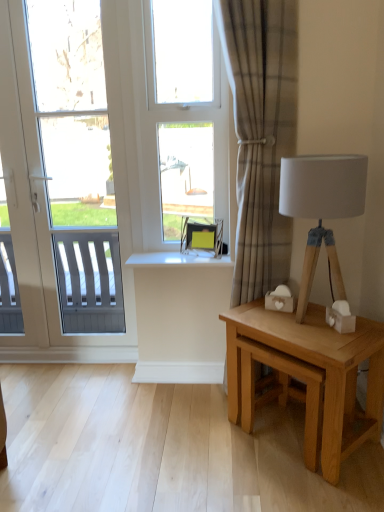
Locate an element on the screen. This screenshot has height=512, width=384. free spot to the left of light brown wooden table at right is located at coordinates (205, 456).